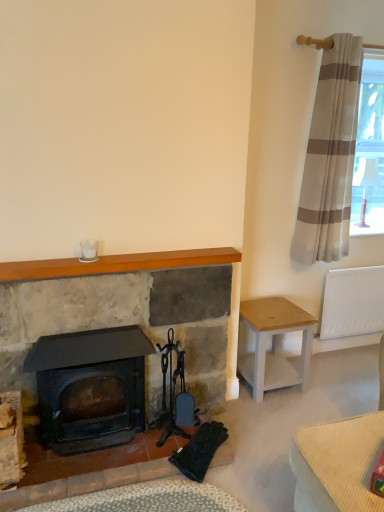
You are a GUI agent. You are given a task and a screenshot of the screen. Output one action in this format:
    pyautogui.click(x=<x>, y=<y>)
    Task: Click on the vacant area on top of matte black wood burning stove at center-left (from a real-world perspective)
    
    Given the screenshot: What is the action you would take?
    [91, 334]